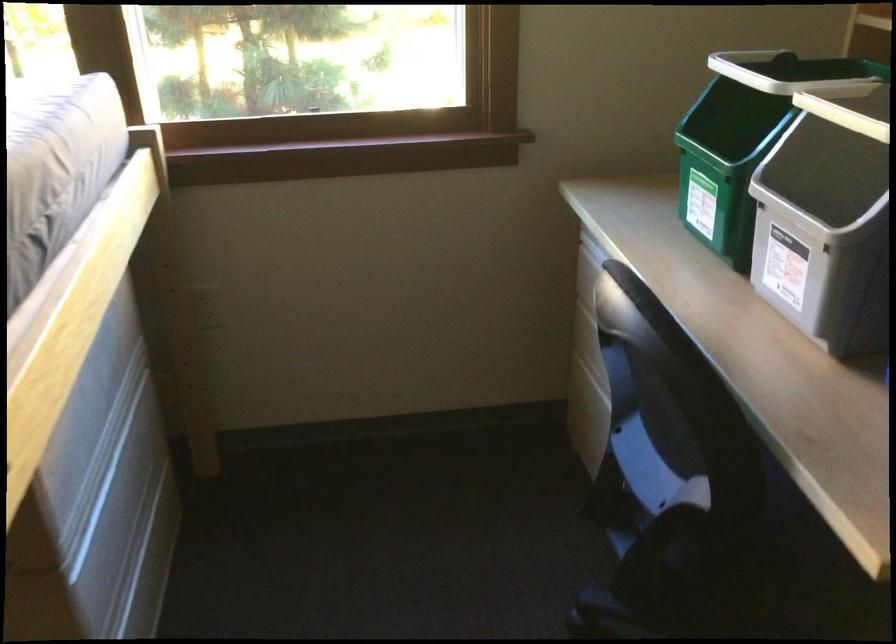
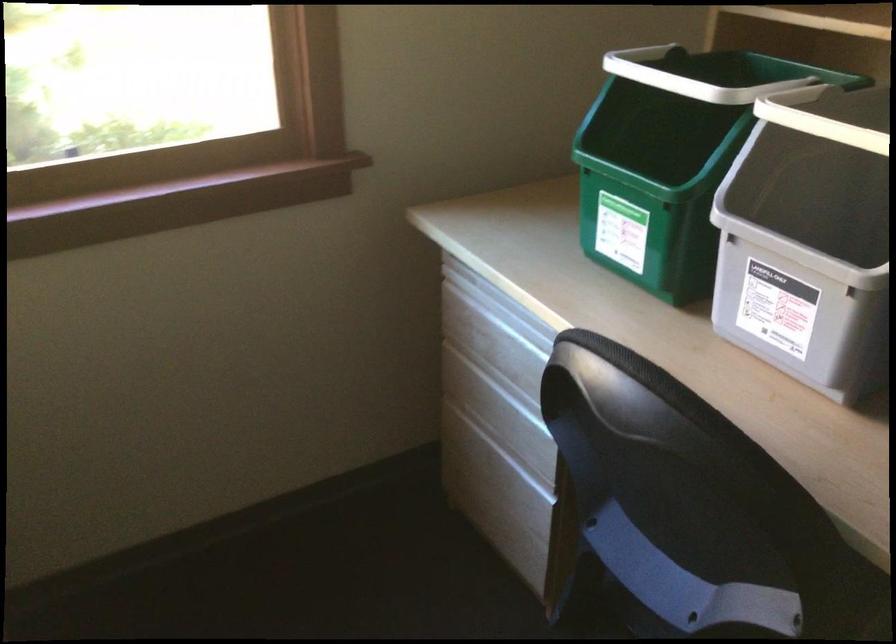
Question: The images are taken continuously from a first-person perspective. In which direction is your viewpoint rotating?

Choices:
 (A) Left
 (B) Right
 (C) Up
 (D) Down

Answer: (B)